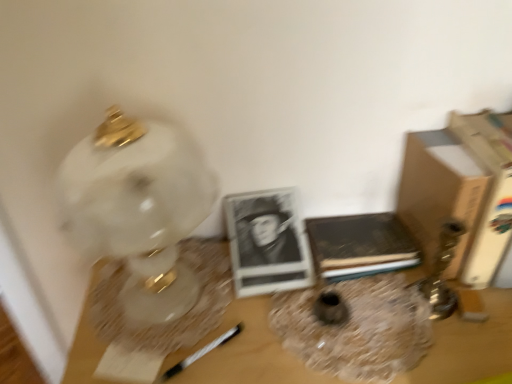
Where is `vacant region under translucent glass vase at center, which is counted as the first vase, starting from the right (from a real-world perspective)`? vacant region under translucent glass vase at center, which is counted as the first vase, starting from the right (from a real-world perspective) is located at coordinates (353, 324).